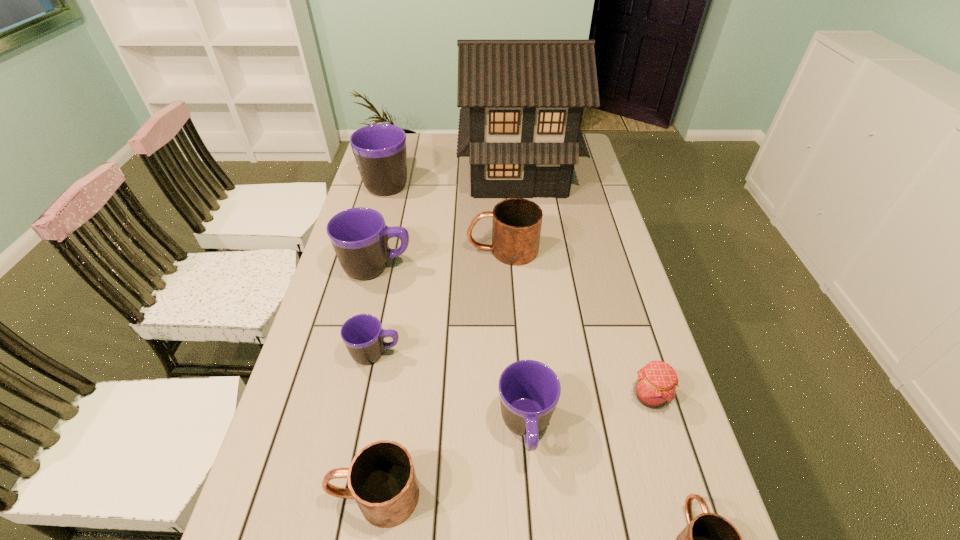
Where is `the fourth farthest mug`? the fourth farthest mug is located at coordinates (363, 335).

The image size is (960, 540). In order to click on the fifth nearest object in this screenshot , I will do `click(363, 335)`.

I want to click on jam, so click(x=655, y=386).

Where is `vacant region located 0.360m on the front-facing side of the tallest object`? The height and width of the screenshot is (540, 960). vacant region located 0.360m on the front-facing side of the tallest object is located at coordinates (529, 278).

Locate an element on the screen. Image resolution: width=960 pixels, height=540 pixels. vacant region located 0.110m with the handle on the side of the farthest mug is located at coordinates (396, 148).

You are a GUI agent. You are given a task and a screenshot of the screen. Output one action in this format:
    pyautogui.click(x=<x>, y=<y>)
    Task: Click on the vacant space located 0.190m with the handle on the side of the farthest mug
    The width and height of the screenshot is (960, 540).
    Given the screenshot: What is the action you would take?
    pyautogui.click(x=398, y=139)

Find the location of a particular element. Image resolution: width=960 pixels, height=540 pixels. vacant region located 0.140m with the handle on the side of the farthest mug is located at coordinates (397, 145).

This screenshot has height=540, width=960. I want to click on free space located 0.140m with the handle on the side of the third nearest black mug, so click(460, 267).

At what (x,y) coordinates should I click in order to perform the action: click on free spot located 0.120m on the side of the second rust mug from left to right with the handle. Please return your answer as a coordinate pair (x, y). Looking at the image, I should click on (429, 250).

What are the coordinates of `free region located on the side of the second rust mug from left to right with the handle` in the screenshot? It's located at (392, 250).